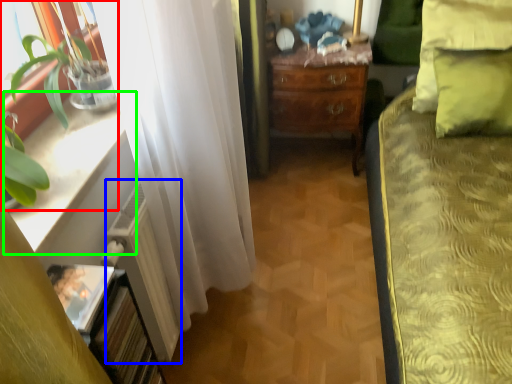
Question: Estimate the real-world distances between objects in this image. Which object is closer to houseplant (highlighted by a red box), radiator (highlighted by a blue box) or window sill (highlighted by a green box)?

Choices:
 (A) radiator
 (B) window sill

Answer: (B)